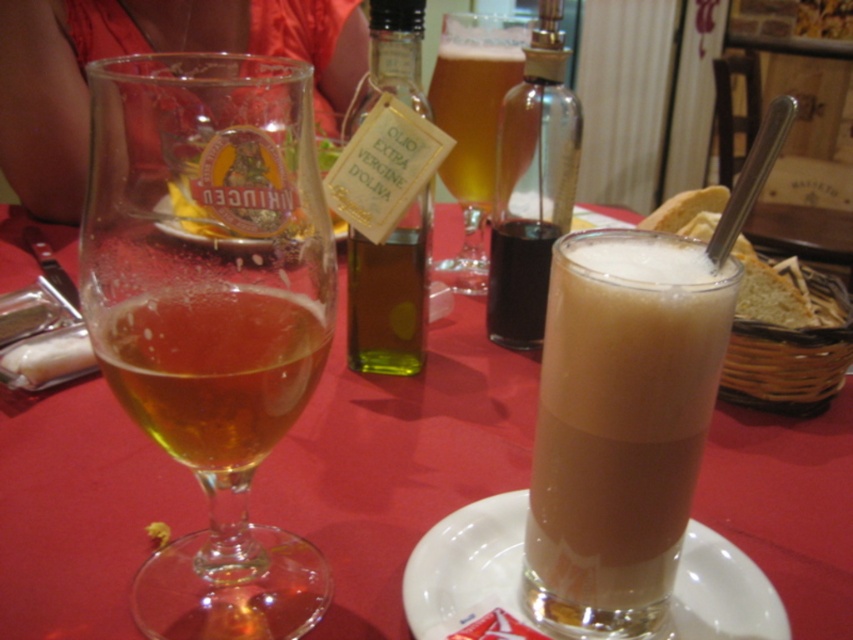
Who is more distant from viewer, (x=560, y=276) or (x=502, y=332)?

Positioned behind is point (x=502, y=332).

I want to click on brown frothy liquid at center, so click(621, 417).

The height and width of the screenshot is (640, 853). What are the coordinates of `brown frothy liquid at center` in the screenshot? It's located at (621, 417).

Who is positioned more to the right, dark brown glass bottle at center or translucent glass beer at center?

Positioned to the right is dark brown glass bottle at center.

Can you confirm if dark brown glass bottle at center is thinner than translucent glass beer at center?

Correct, dark brown glass bottle at center's width is less than translucent glass beer at center's.

Which is in front, point (537, 164) or point (485, 209)?

Point (537, 164) is more forward.

Locate an element on the screen. dark brown glass bottle at center is located at coordinates (531, 184).

Does translucent glass at center have a lesser height compared to translucent glass beer at center?

No.

Can you confirm if translucent glass at center is taller than translucent glass beer at center?

Correct, translucent glass at center is much taller as translucent glass beer at center.

You are a GUI agent. You are given a task and a screenshot of the screen. Output one action in this format:
    pyautogui.click(x=<x>, y=<y>)
    Task: Click on the translucent glass at center
    The height and width of the screenshot is (640, 853).
    Given the screenshot: What is the action you would take?
    pyautogui.click(x=397, y=460)